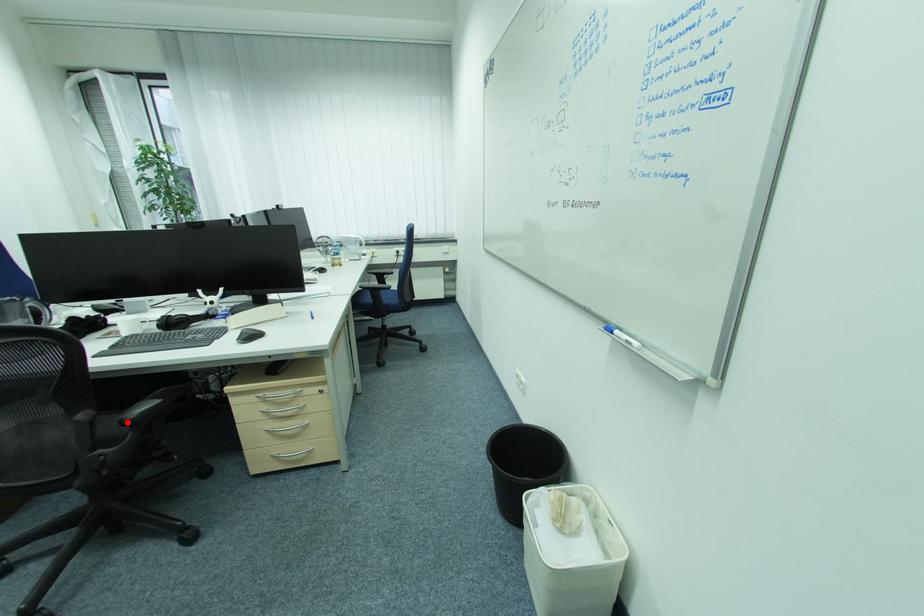
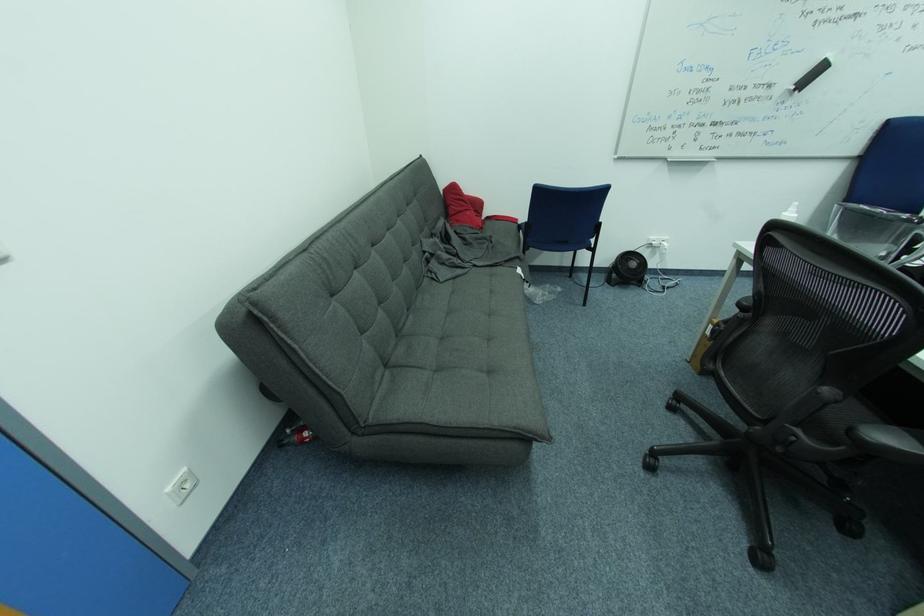
Question: I am providing you with two images of the same scene from different viewpoints. A red point is shown in image1. For the corresponding object point in image2, is it positioned nearer or farther from the camera?

Choices:
 (A) Nearer
 (B) Farther

Answer: (A)